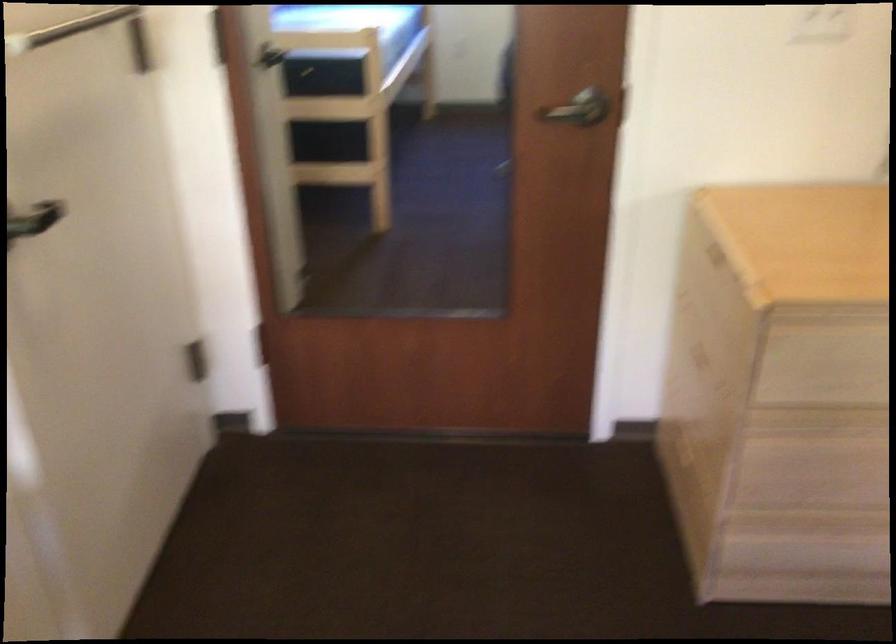
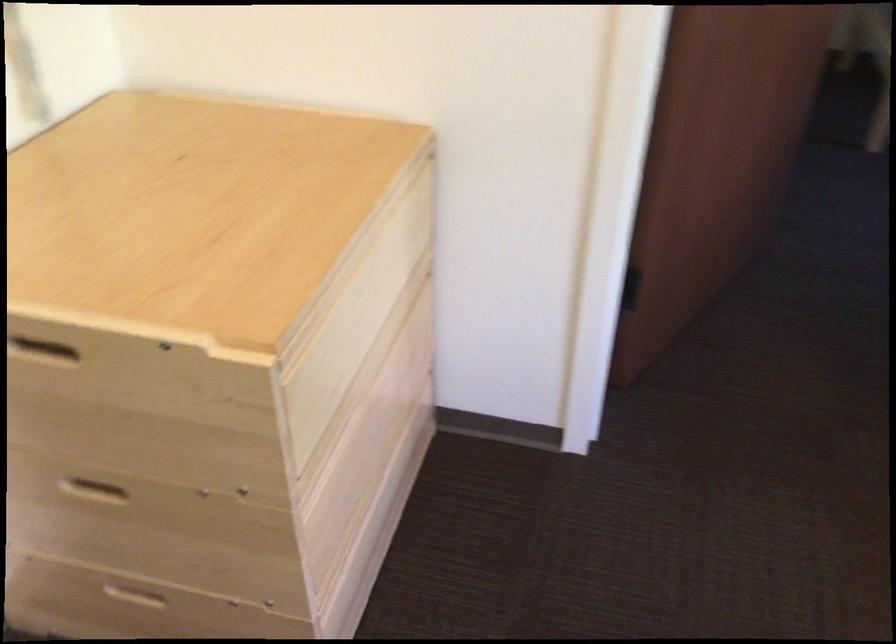
Find the pixel in the second image that matches point 679,450 in the first image.

(135, 600)